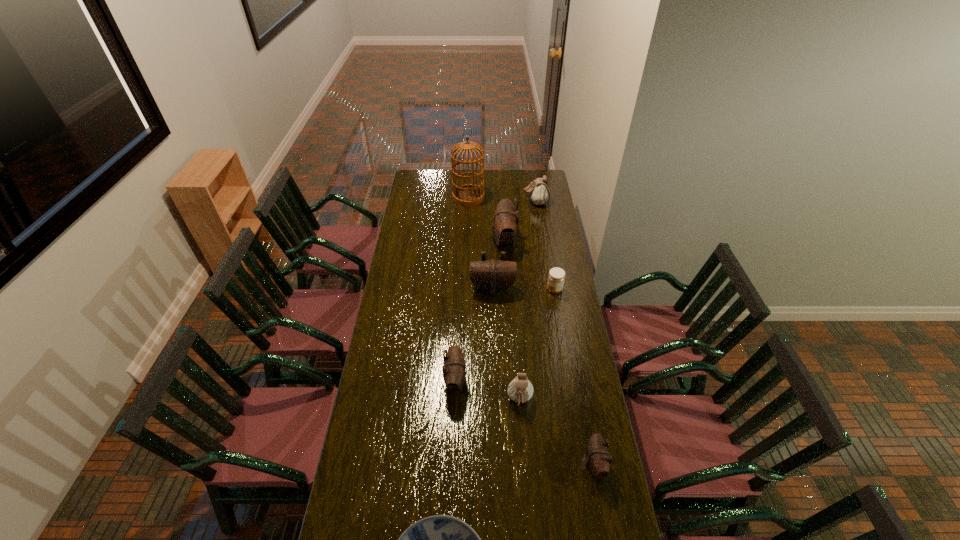
The image size is (960, 540). Find the location of `free spot located 0.140m on the front-facing side of the right white pouch`. free spot located 0.140m on the front-facing side of the right white pouch is located at coordinates (500, 202).

Locate an element on the screen. The width and height of the screenshot is (960, 540). vacant space located on the front-facing side of the right white pouch is located at coordinates (511, 202).

Find the location of a particular element. free space located with the flap open on the leftmost pouch is located at coordinates (512, 382).

Image resolution: width=960 pixels, height=540 pixels. Identify the location of vacant space located 0.180m on the front-facing side of the left white pouch. (524, 460).

Find the location of a particular element. free space located 0.360m with the flap open on the eighth farthest object is located at coordinates (484, 464).

Image resolution: width=960 pixels, height=540 pixels. In order to click on vacant space located 0.260m with the flap open on the eighth farthest object in this screenshot , I will do `click(512, 464)`.

This screenshot has height=540, width=960. In order to click on free space located with the flap open on the eighth farthest object in this screenshot , I will do `click(492, 464)`.

The width and height of the screenshot is (960, 540). What are the coordinates of `free space located on the front label of the orange jam` in the screenshot? It's located at (496, 289).

You are a GUI agent. You are given a task and a screenshot of the screen. Output one action in this format:
    pyautogui.click(x=<x>, y=<y>)
    Task: Click on the vacant region located 0.220m on the front label of the orange jam
    This screenshot has height=540, width=960.
    Given the screenshot: What is the action you would take?
    pyautogui.click(x=502, y=289)

Locate an element on the screen. This screenshot has height=540, width=960. free space located 0.110m on the front label of the orange jam is located at coordinates (524, 289).